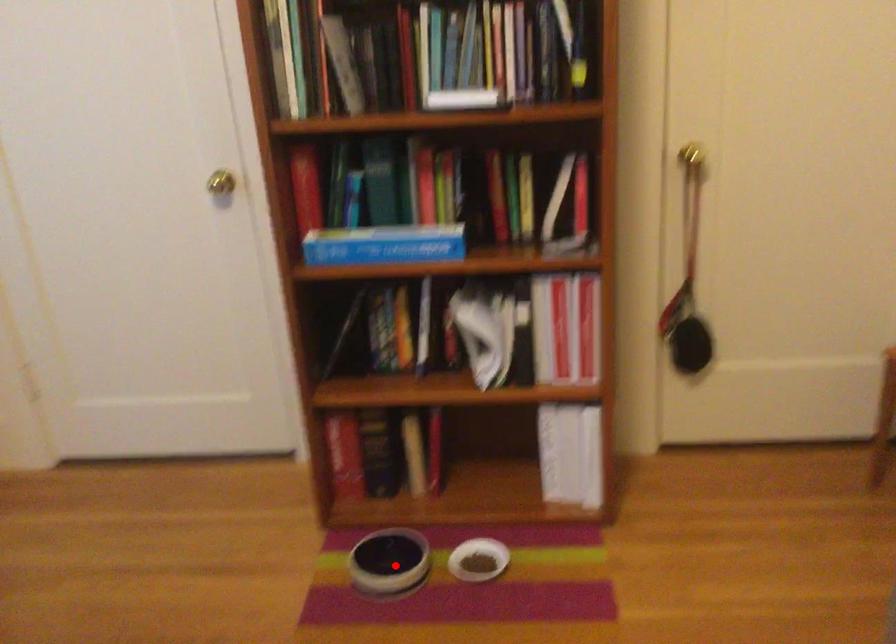
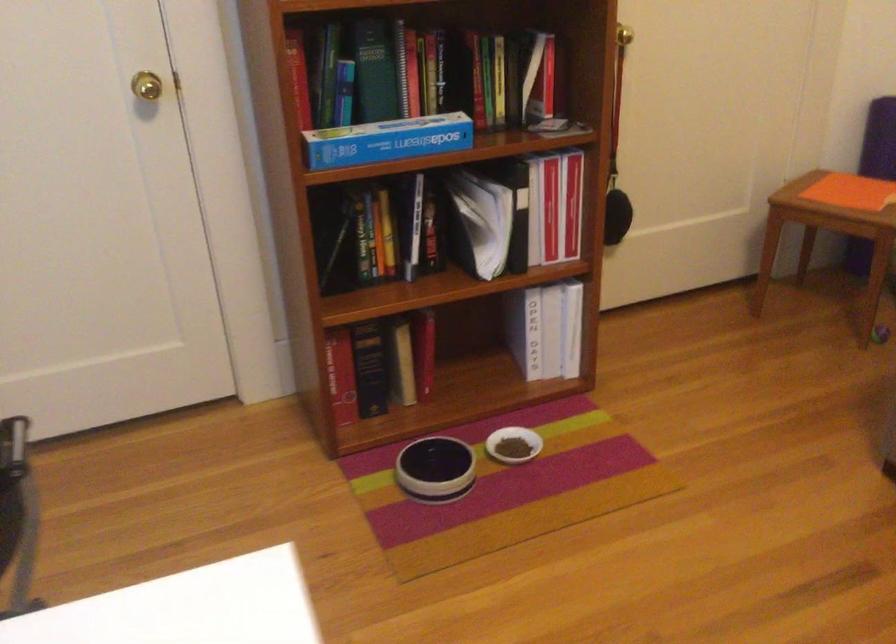
In the second image, find the point that corresponds to the highlighted location in the first image.

(435, 468)